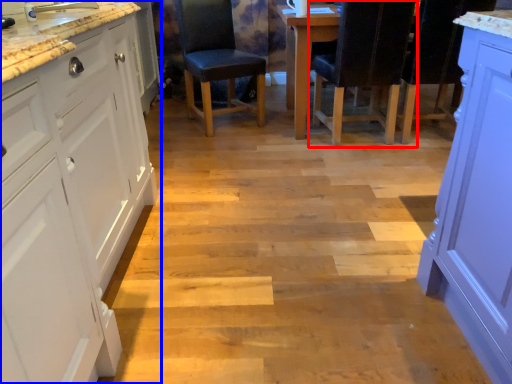
Question: Which object appears closest to the camera in this image, chair (highlighted by a red box) or cabinetry (highlighted by a blue box)?

Choices:
 (A) chair
 (B) cabinetry

Answer: (B)